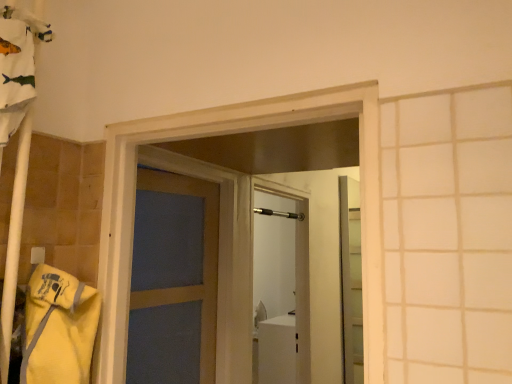
Question: Based on their positions, is metallic silver shower at center located to the left or right of metallic elevator at right?

Choices:
 (A) right
 (B) left

Answer: (B)

Question: Is point (259, 213) positioned closer to the camera than point (344, 322)?

Choices:
 (A) farther
 (B) closer

Answer: (A)

Question: Is metallic silver shower at center taller or shorter than metallic elevator at right?

Choices:
 (A) short
 (B) tall

Answer: (A)

Question: From a real-world perspective, relative to metallic silver shower at center, is metallic elevator at right vertically above or below?

Choices:
 (A) above
 (B) below

Answer: (B)

Question: Considering the positions of metallic elevator at right and metallic silver shower at center in the image, is metallic elevator at right taller or shorter than metallic silver shower at center?

Choices:
 (A) tall
 (B) short

Answer: (A)

Question: Is metallic elevator at right wider or thinner than metallic silver shower at center?

Choices:
 (A) wide
 (B) thin

Answer: (B)

Question: Does point (360, 332) appear closer or farther from the camera than point (292, 213)?

Choices:
 (A) farther
 (B) closer

Answer: (A)